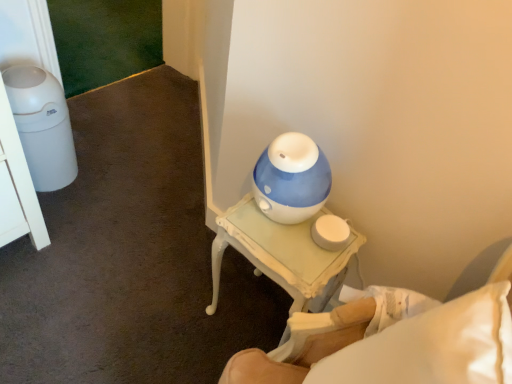
The height and width of the screenshot is (384, 512). I want to click on white painted wood nightstand at lower right, so click(393, 340).

Image resolution: width=512 pixels, height=384 pixels. What do you see at coordinates (393, 340) in the screenshot?
I see `white painted wood nightstand at lower right` at bounding box center [393, 340].

Where is `white painted wood table at center`? This screenshot has height=384, width=512. white painted wood table at center is located at coordinates (282, 255).

This screenshot has width=512, height=384. What do you see at coordinates (282, 255) in the screenshot? I see `white painted wood table at center` at bounding box center [282, 255].

This screenshot has width=512, height=384. I want to click on white painted wood nightstand at lower right, so click(x=393, y=340).

Is white painted wood table at center to the left or to the right of white painted wood nightstand at lower right in the image?

In the image, white painted wood table at center appears on the left side of white painted wood nightstand at lower right.

Which is in front, white painted wood table at center or white painted wood nightstand at lower right?

Positioned in front is white painted wood nightstand at lower right.

Is point (253, 203) closer or farther from the camera than point (362, 299)?

Point (253, 203) appears to be farther away from the viewer than point (362, 299).

Looking at this image, from the image's perspective, would you say white painted wood table at center is shown under white painted wood nightstand at lower right?

No, from the image's perspective, white painted wood table at center is not below white painted wood nightstand at lower right.

From a real-world perspective, is white painted wood table at center over white painted wood nightstand at lower right?

Actually, white painted wood table at center is physically below white painted wood nightstand at lower right in the real world.

Looking at this image, which object is thinner, white painted wood table at center or white painted wood nightstand at lower right?

With smaller width is white painted wood table at center.

Who is taller, white painted wood table at center or white painted wood nightstand at lower right?

With more height is white painted wood nightstand at lower right.

Between white painted wood table at center and white painted wood nightstand at lower right, which one has larger size?

white painted wood nightstand at lower right.

Is white painted wood table at center inside or outside of white painted wood nightstand at lower right?

Result: white painted wood table at center is spatially situated outside white painted wood nightstand at lower right.

Would you consider white painted wood table at center to be distant from white painted wood nightstand at lower right?

white painted wood table at center is near white painted wood nightstand at lower right, not far away.

Is white painted wood table at center aimed at white painted wood nightstand at lower right?

No, white painted wood table at center does not turn towards white painted wood nightstand at lower right.

The height and width of the screenshot is (384, 512). What are the coordinates of `table that appears below the white painted wood nightstand at lower right (from a real-world perspective)` in the screenshot? It's located at (282, 255).

Considering the relative positions of white painted wood nightstand at lower right and white painted wood table at center in the image provided, is white painted wood nightstand at lower right to the left or to the right of white painted wood table at center?

From the image, it's evident that white painted wood nightstand at lower right is to the right of white painted wood table at center.

Is white painted wood nightstand at lower right positioned in front of white painted wood table at center?

Yes.

Is point (451, 344) closer or farther from the camera than point (326, 290)?

Clearly, point (451, 344) is closer to the camera than point (326, 290).

From the image's perspective, which one is positioned higher, white painted wood nightstand at lower right or white painted wood table at center?

From the image's view, white painted wood table at center is above.

From a real-world perspective, is white painted wood nightstand at lower right positioned above or below white painted wood table at center?

Clearly, from a real-world perspective, white painted wood nightstand at lower right is above white painted wood table at center.

Is white painted wood nightstand at lower right wider or thinner than white painted wood table at center?

white painted wood nightstand at lower right is wider than white painted wood table at center.

Is white painted wood nightstand at lower right taller or shorter than white painted wood table at center?

In the image, white painted wood nightstand at lower right appears to be taller than white painted wood table at center.

Is white painted wood nightstand at lower right bigger than white painted wood table at center?

Correct, white painted wood nightstand at lower right is larger in size than white painted wood table at center.

Is white painted wood nightstand at lower right spatially inside white painted wood table at center, or outside of it?

white painted wood nightstand at lower right is not inside white painted wood table at center, it's outside.

Is white painted wood nightstand at lower right in contact with white painted wood table at center?

white painted wood nightstand at lower right is not next to white painted wood table at center, and they're not touching.

From the picture: Is white painted wood nightstand at lower right facing away from white painted wood table at center?

white painted wood nightstand at lower right does not have its back to white painted wood table at center.

Identify the location of table behind the white painted wood nightstand at lower right. The image size is (512, 384). (282, 255).

Identify the location of table located above the white painted wood nightstand at lower right (from the image's perspective). The height and width of the screenshot is (384, 512). (282, 255).

Locate an element on the screen. table on the left of white painted wood nightstand at lower right is located at coordinates (282, 255).